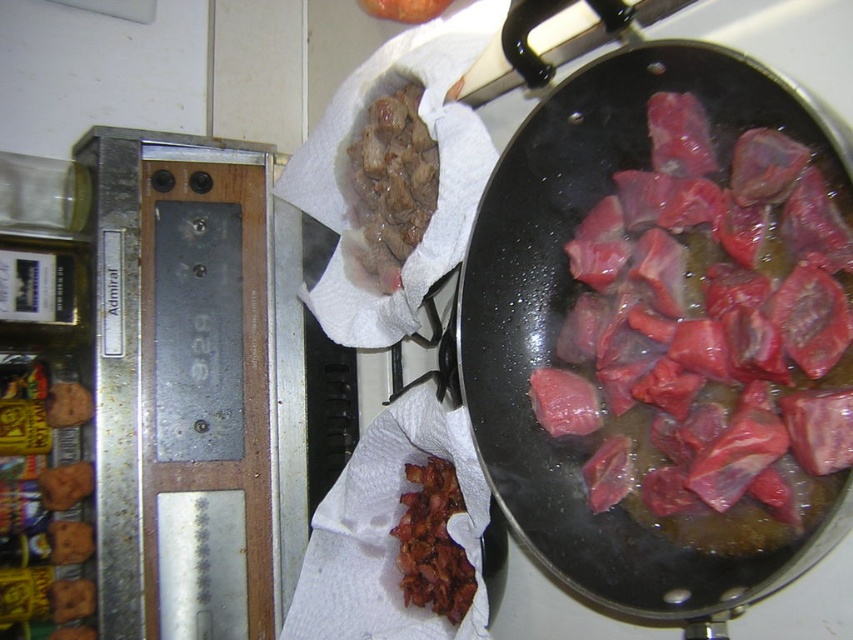
You are a chef trying to place a 12 cm long spatula between the shiny black wok at center and the slightly crispy bacon at center. Will the spatula fit in the space between them?

The shiny black wok at center is 11.80 centimeters away from slightly crispy bacon at center. Since the spatula is 12 cm long, it will not fit in the space between them as the distance is slightly shorter than the spatula.

You are a chef standing at the stovetop and need to reach the shiny black wok at center. Your arm can extend 24 inches. Can you reach it without moving your body?

The shiny black wok at center is 19.25 inches away from the camera, so yes, the chef can reach it with their arm extended 24 inches since it is within reach.

You are a chef preparing a stir fry dish. You have a shiny black wok at center and slightly crispy bacon at center. Which object should you use to cook the bacon to ensure it becomes extra crispy?

The slightly crispy bacon at center should be cooked in the shiny black wok at center since the wok is wider, allowing for better heat distribution and space to crisp the bacon further.